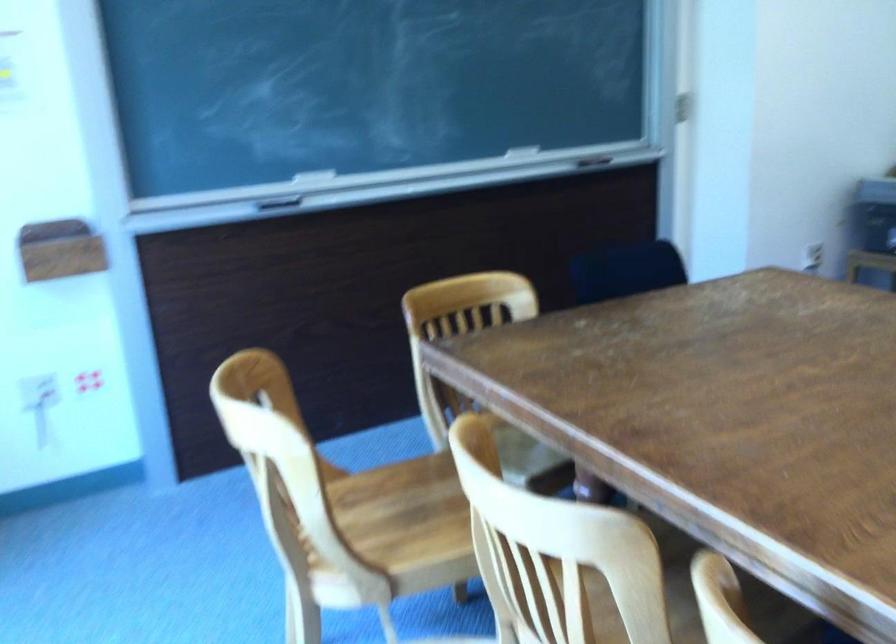
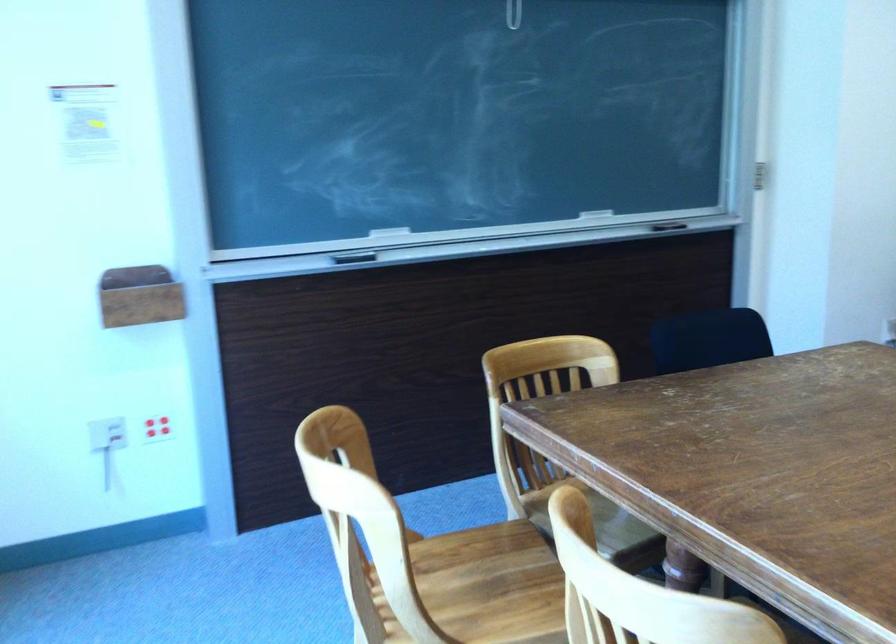
Question: Based on the continuous images, in which direction is the camera rotating? Reply with the corresponding letter.

Choices:
 (A) Left
 (B) Right
 (C) Up
 (D) Down

Answer: (C)